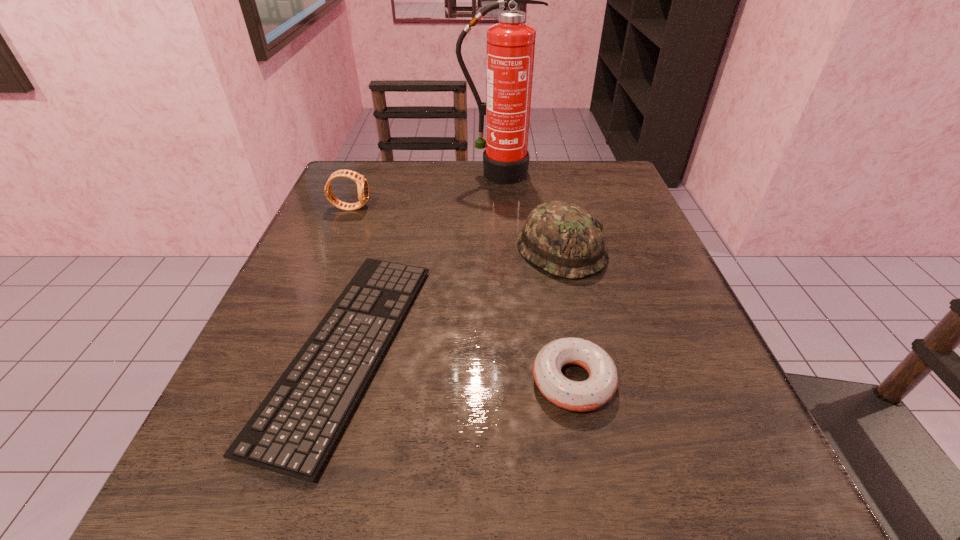
Locate an element on the screen. vacant space that satisfies the following two spatial constraints: 1. on the front-facing side of the tallest object; 2. on the face of the watch is located at coordinates (499, 207).

Find the location of `free spot that satisfies the following two spatial constraints: 1. on the front-facing side of the headwear; 2. on the left side of the fire extinguisher`. free spot that satisfies the following two spatial constraints: 1. on the front-facing side of the headwear; 2. on the left side of the fire extinguisher is located at coordinates (501, 251).

You are a GUI agent. You are given a task and a screenshot of the screen. Output one action in this format:
    pyautogui.click(x=<x>, y=<y>)
    Task: Click on the free spot that satisfies the following two spatial constraints: 1. on the front-facing side of the farthest object; 2. on the right side of the doughnut
    
    Given the screenshot: What is the action you would take?
    pyautogui.click(x=510, y=381)

I want to click on vacant space that satisfies the following two spatial constraints: 1. on the front side of the computer keyboard; 2. on the right side of the doughnut, so click(x=338, y=381).

What are the coordinates of `free space that satisfies the following two spatial constraints: 1. on the front-facing side of the fire extinguisher; 2. on the right side of the fourth tallest object` in the screenshot? It's located at (510, 381).

At what (x,y) coordinates should I click in order to perform the action: click on free space that satisfies the following two spatial constraints: 1. on the back side of the headwear; 2. on the face of the fourth nearest object. Please return your answer as a coordinate pair (x, y). Image resolution: width=960 pixels, height=540 pixels. Looking at the image, I should click on (551, 207).

In order to click on vacant space that satisfies the following two spatial constraints: 1. on the face of the headwear; 2. on the left side of the watch in this screenshot , I will do `click(332, 251)`.

The image size is (960, 540). Identify the location of vacant space that satisfies the following two spatial constraints: 1. on the face of the watch; 2. on the back side of the doughnut. point(278,381).

The image size is (960, 540). Identify the location of vacant space that satisfies the following two spatial constraints: 1. on the front side of the shortest object; 2. on the left side of the doughnut. (338, 381).

Where is `free spot that satisfies the following two spatial constraints: 1. on the face of the doughnut; 2. on the right side of the second farthest object`? The height and width of the screenshot is (540, 960). free spot that satisfies the following two spatial constraints: 1. on the face of the doughnut; 2. on the right side of the second farthest object is located at coordinates (278, 381).